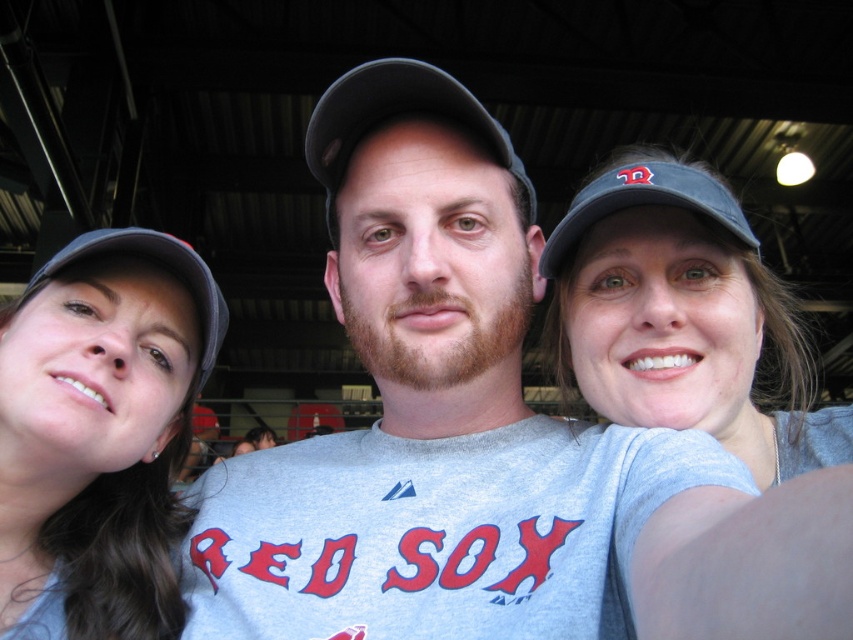
Question: Among these points, which one is farthest from the camera?

Choices:
 (A) (721, 205)
 (B) (190, 257)
 (C) (498, 134)
 (D) (434, 544)

Answer: (B)

Question: Is gray matte baseball cap at center wider than gray fabric cap at upper left?

Choices:
 (A) no
 (B) yes

Answer: (B)

Question: Can you confirm if gray matte baseball cap at center is bigger than gray fabric cap at upper left?

Choices:
 (A) yes
 (B) no

Answer: (A)

Question: Among these points, which one is farthest from the camera?

Choices:
 (A) (155, 547)
 (B) (355, 72)

Answer: (A)

Question: Which of these objects is positioned closest to the gray fabric cap at upper right?

Choices:
 (A) gray fabric cap at upper left
 (B) gray matte baseball cap at center
 (C) black fabric baseball cap at center

Answer: (B)

Question: Is gray fabric cap at upper right thinner than black fabric baseball cap at center?

Choices:
 (A) no
 (B) yes

Answer: (A)